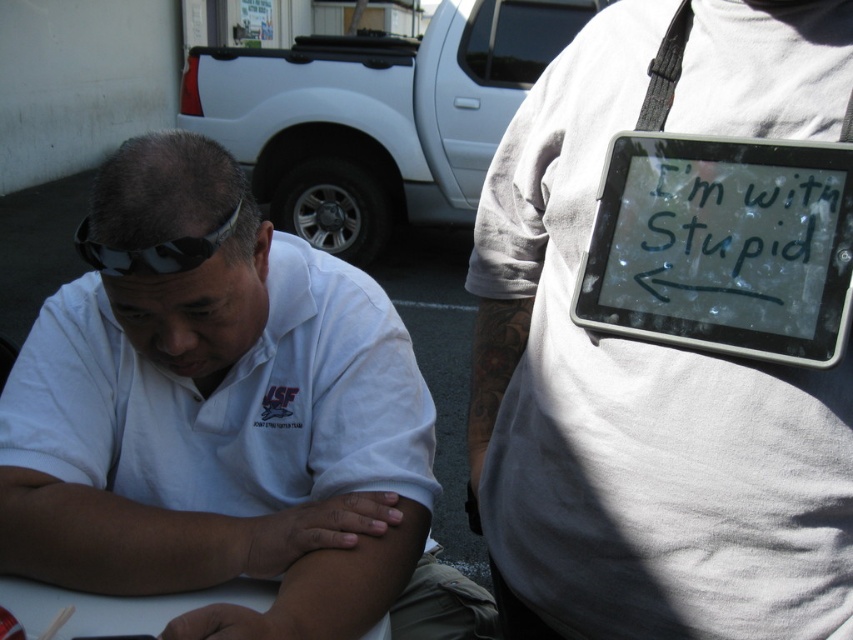
Which is more to the left, clear plastic tablet at upper right or white matte table at lower left?

Positioned to the left is white matte table at lower left.

This screenshot has height=640, width=853. What do you see at coordinates (722, 246) in the screenshot?
I see `clear plastic tablet at upper right` at bounding box center [722, 246].

The image size is (853, 640). Describe the element at coordinates (722, 246) in the screenshot. I see `clear plastic tablet at upper right` at that location.

Find the location of a particular element. This screenshot has height=640, width=853. clear plastic tablet at upper right is located at coordinates (x=722, y=246).

Which is below, white matte tablet at upper right or camouflage fabric goggles at upper left?

white matte tablet at upper right is below.

Does white matte tablet at upper right have a lesser height compared to camouflage fabric goggles at upper left?

In fact, white matte tablet at upper right may be taller than camouflage fabric goggles at upper left.

Does point (508, 355) come farther from viewer compared to point (216, 241)?

Yes, it is.

This screenshot has height=640, width=853. Find the location of `white matte tablet at upper right`. white matte tablet at upper right is located at coordinates (636, 412).

Which is more to the left, white matte tablet at upper right or clear plastic tablet at upper right?

Positioned to the left is white matte tablet at upper right.

Can you confirm if white matte tablet at upper right is bigger than clear plastic tablet at upper right?

Indeed, white matte tablet at upper right has a larger size compared to clear plastic tablet at upper right.

The height and width of the screenshot is (640, 853). Describe the element at coordinates (636, 412) in the screenshot. I see `white matte tablet at upper right` at that location.

The image size is (853, 640). In order to click on white matte tablet at upper right in this screenshot , I will do `click(636, 412)`.